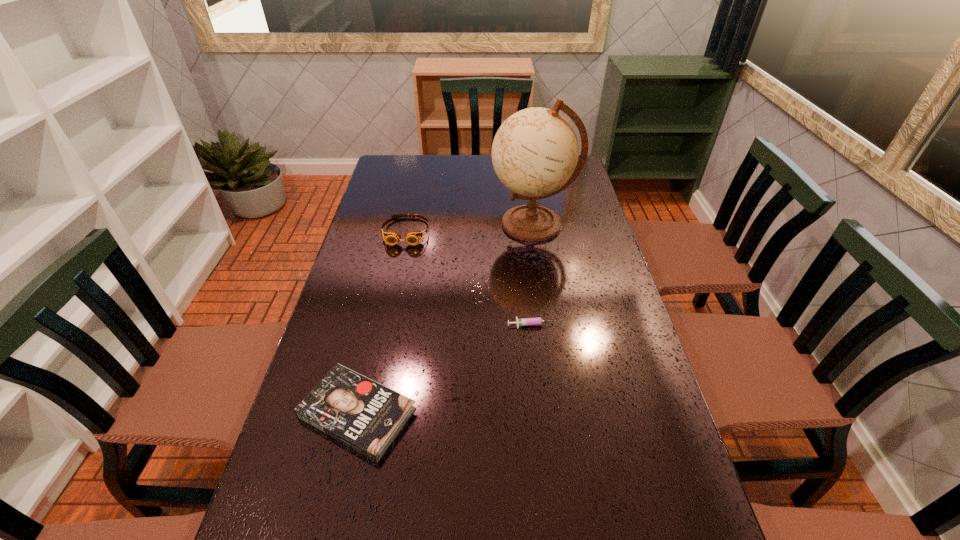
Image resolution: width=960 pixels, height=540 pixels. I want to click on free space between the nearest object and the tallest object, so click(445, 319).

Identify the location of unoccupied area between the goggles and the globe. The height and width of the screenshot is (540, 960). coord(469,228).

The width and height of the screenshot is (960, 540). What are the coordinates of `free space between the second tallest object and the second nearest object` in the screenshot? It's located at (x=470, y=279).

Where is `unoccupied area between the globe and the second shortest object`? unoccupied area between the globe and the second shortest object is located at coordinates (445, 319).

Where is `unoccupied position between the syringe and the second tallest object`? The width and height of the screenshot is (960, 540). unoccupied position between the syringe and the second tallest object is located at coordinates (470, 279).

Where is `free spot between the book and the second tallest object`? The width and height of the screenshot is (960, 540). free spot between the book and the second tallest object is located at coordinates (382, 322).

Image resolution: width=960 pixels, height=540 pixels. Find the location of `free space between the globe and the nearest object`. free space between the globe and the nearest object is located at coordinates (445, 319).

Image resolution: width=960 pixels, height=540 pixels. Identify the location of blank region between the shortest object and the goggles. (470, 279).

What are the coordinates of `the second closest object relative to the book` in the screenshot? It's located at (392, 238).

Select which object appears as the closest to the goggles. Please provide its 2D coordinates. Your answer should be formatted as a tuple, i.e. [(x, y)], where the tuple contains the x and y coordinates of a point satisfying the conditions above.

[(535, 151)]